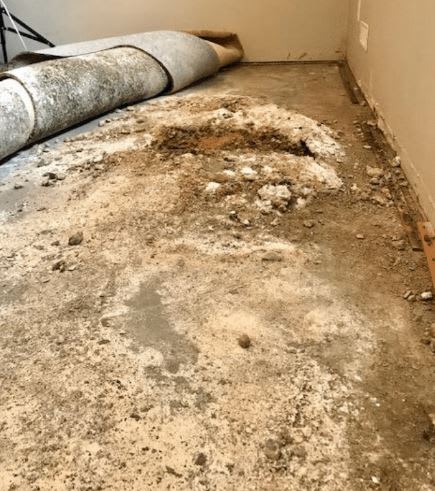
Find the location of a particular element. The image size is (435, 491). carpet roll is located at coordinates click(x=113, y=67).